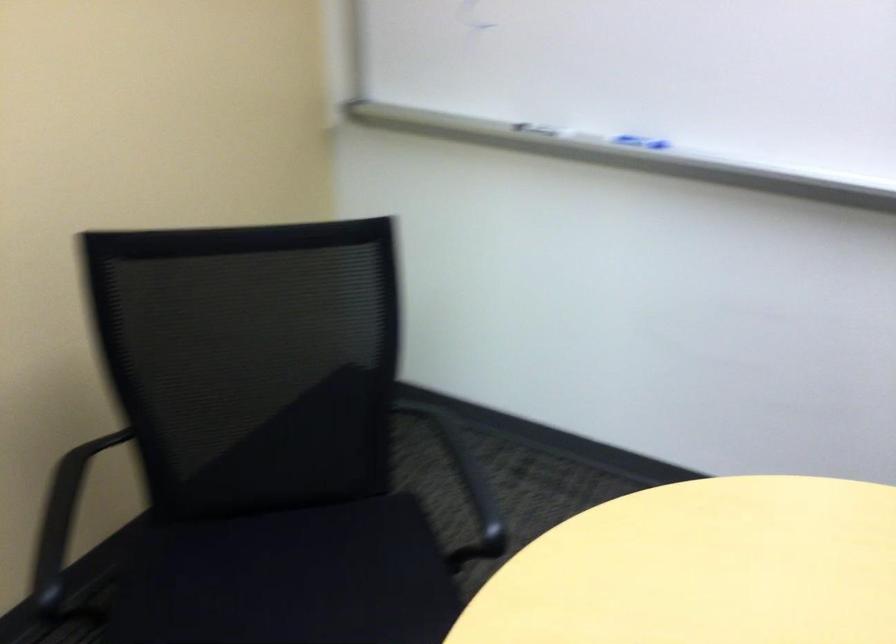
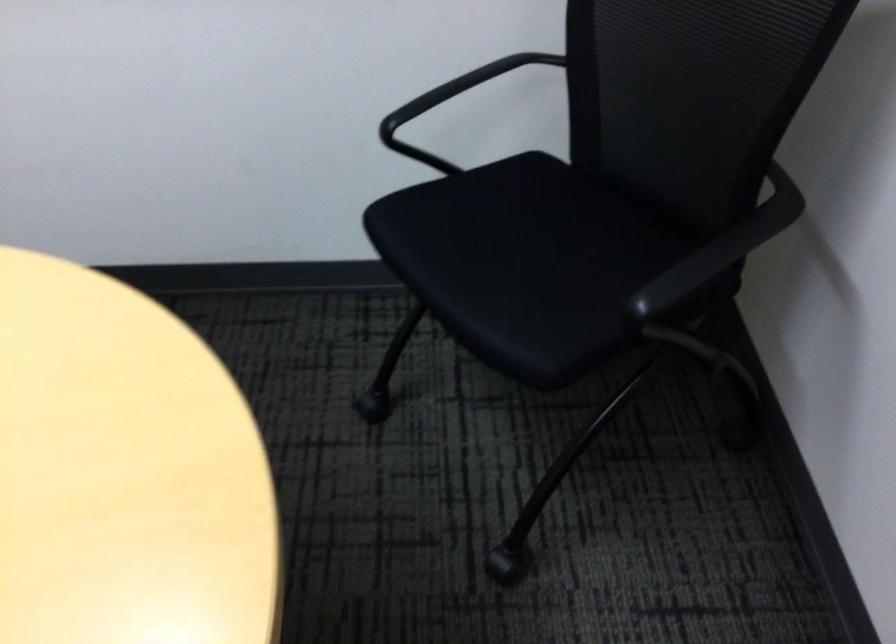
First-person continuous shooting, in which direction is the camera rotating?

The rotation direction of the camera is right-down.